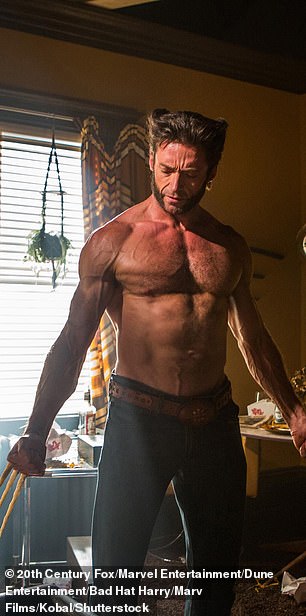
Identify the location of blind. (19, 201).